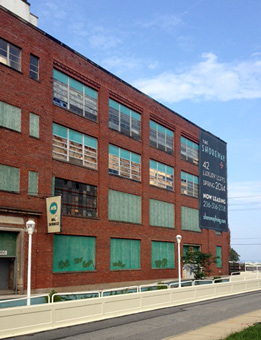
The image size is (261, 340). In order to click on hanging banner in this screenshot , I will do `click(55, 211)`.